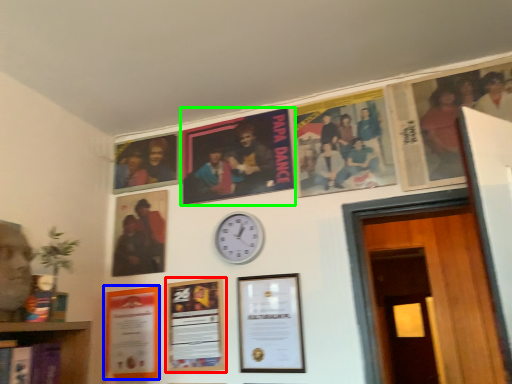
Question: Which is nearer to the picture frame (highlighted by a red box)? picture frame (highlighted by a blue box) or poster (highlighted by a green box).

Choices:
 (A) picture frame
 (B) poster

Answer: (A)